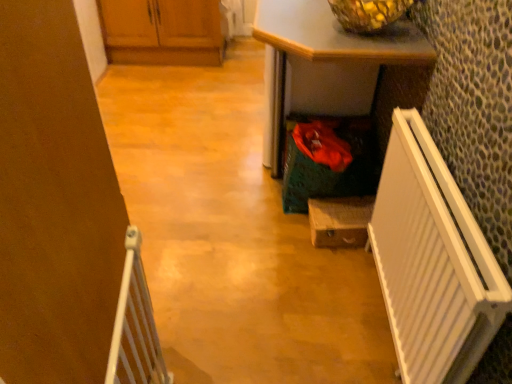
This screenshot has width=512, height=384. What are the coordinates of `free space above wooden drawer at center, which is the second cabinetry in back-to-front order (from a real-world perspective)` in the screenshot? It's located at (339, 207).